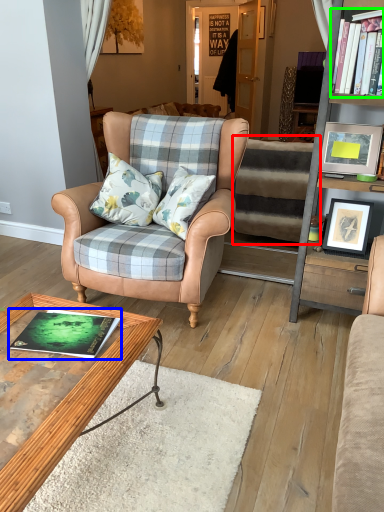
Question: Considering the real-world distances, which object is closest to stairwell (highlighted by a red box)? book (highlighted by a blue box) or book (highlighted by a green box).

Choices:
 (A) book
 (B) book

Answer: (B)